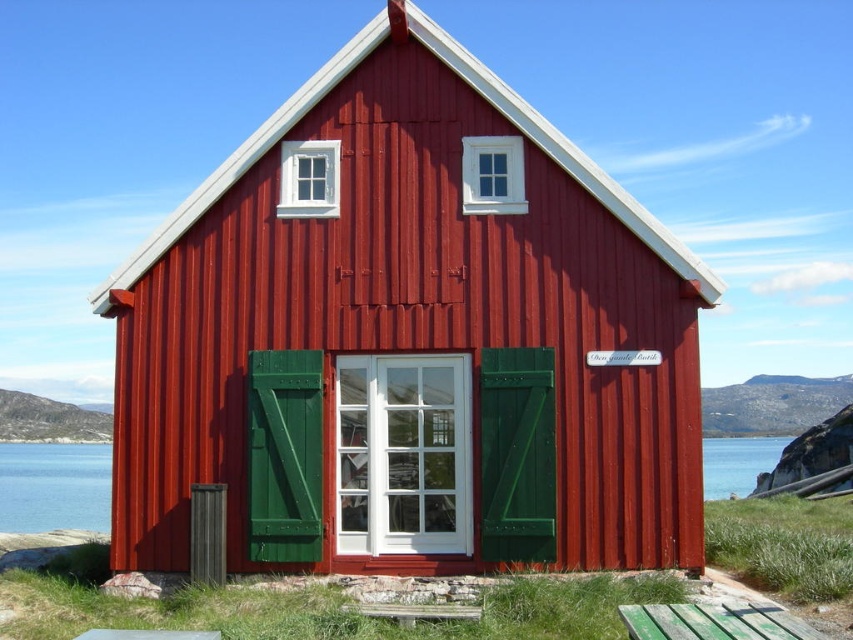
Is the position of smooth wooden hut at center more distant than that of green weathered wood picnic table at lower right?

That is True.

Describe the element at coordinates (409, 339) in the screenshot. I see `smooth wooden hut at center` at that location.

Does point (511, 515) lie in front of point (645, 618)?

No, it is behind (645, 618).

In order to click on smooth wooden hut at center in this screenshot , I will do `click(409, 339)`.

Between point (650, 388) and point (94, 525), which one is positioned in front?

Point (650, 388) is in front.

Can you confirm if smooth wooden hut at center is taller than transparent glass water at lower center?

No, smooth wooden hut at center is not taller than transparent glass water at lower center.

Describe the element at coordinates (409, 339) in the screenshot. I see `smooth wooden hut at center` at that location.

Locate an element on the screen. smooth wooden hut at center is located at coordinates (409, 339).

Does point (32, 486) come behind point (773, 605)?

That is True.

Which of these two, transparent glass water at lower center or green weathered wood picnic table at lower right, stands taller?

Standing taller between the two is transparent glass water at lower center.

Where is `transparent glass water at lower center`? Image resolution: width=853 pixels, height=640 pixels. transparent glass water at lower center is located at coordinates (54, 486).